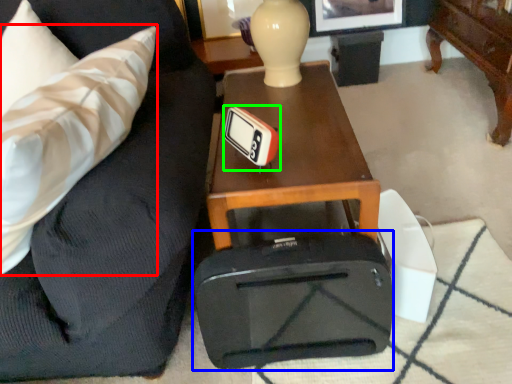
Question: Which is farther away from throw pillow (highlighted by a red box)? luggage (highlighted by a blue box) or thermometer (highlighted by a green box)?

Choices:
 (A) luggage
 (B) thermometer

Answer: (A)